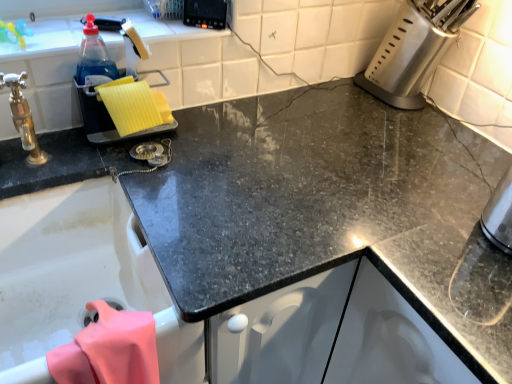
Locate an element on the screen. This screenshot has width=512, height=384. unoccupied area in front of satin silver knife block at upper right, the 1th appliance when ordered from right to left is located at coordinates (403, 134).